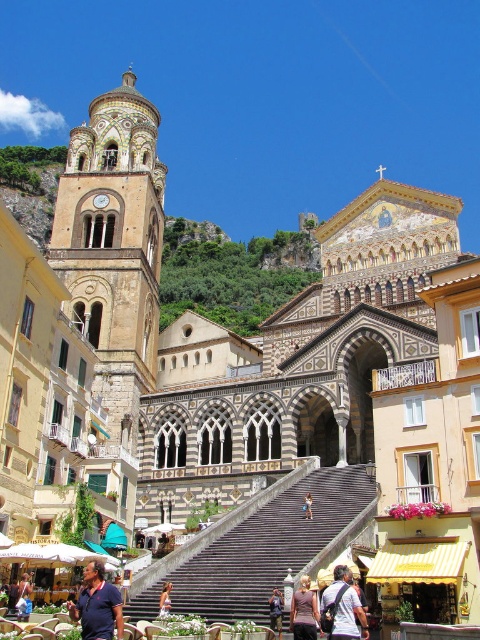
Question: Which object appears closest to the camera in this image?

Choices:
 (A) blue cotton shirt at lower left
 (B) dark brown leather backpack at center
 (C) golden stone tower at center

Answer: (A)

Question: Is golden stone tower at center positioned in front of purple floral dress at center?

Choices:
 (A) yes
 (B) no

Answer: (B)

Question: Can you confirm if golden stone tower at center is positioned below light brown wooden chair at center?

Choices:
 (A) no
 (B) yes

Answer: (A)

Question: Does golden stone tower at center have a larger size compared to black stone stairs at center?

Choices:
 (A) yes
 (B) no

Answer: (A)

Question: Which object is farther from the camera taking this photo?

Choices:
 (A) blue denim jeans at center
 (B) black stone stairs at center

Answer: (B)

Question: Considering the real-world distances, which object is farthest from the purple fabric shirt at center?

Choices:
 (A) golden stone tower at center
 (B) blue cotton shirt at lower left
 (C) purple floral dress at center
 (D) light brown wooden chair at center

Answer: (A)